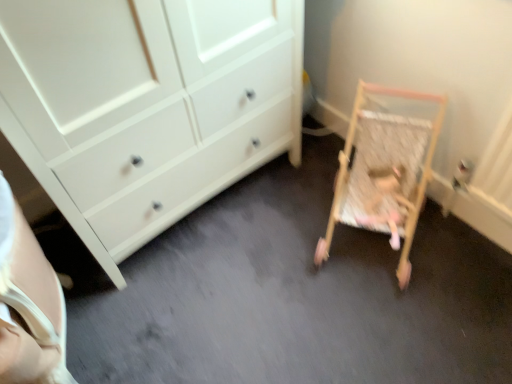
Question: Is wooden baby cot at lower right thinner than wooden rocking chair at right?

Choices:
 (A) no
 (B) yes

Answer: (A)

Question: Is wooden baby cot at lower right oriented away from wooden rocking chair at right?

Choices:
 (A) yes
 (B) no

Answer: (A)

Question: Would you say wooden baby cot at lower right is a long distance from wooden rocking chair at right?

Choices:
 (A) yes
 (B) no

Answer: (B)

Question: Does wooden baby cot at lower right appear on the right side of wooden rocking chair at right?

Choices:
 (A) yes
 (B) no

Answer: (B)

Question: Does wooden baby cot at lower right have a lesser height compared to wooden rocking chair at right?

Choices:
 (A) yes
 (B) no

Answer: (B)

Question: Is the depth of wooden baby cot at lower right greater than that of wooden rocking chair at right?

Choices:
 (A) no
 (B) yes

Answer: (A)

Question: Is wooden rocking chair at right shorter than wooden baby cot at lower right?

Choices:
 (A) yes
 (B) no

Answer: (A)

Question: Does wooden rocking chair at right lie in front of wooden baby cot at lower right?

Choices:
 (A) yes
 (B) no

Answer: (B)

Question: Is wooden rocking chair at right not within wooden baby cot at lower right?

Choices:
 (A) yes
 (B) no

Answer: (B)

Question: From the image's perspective, does wooden rocking chair at right appear higher than wooden baby cot at lower right?

Choices:
 (A) no
 (B) yes

Answer: (A)

Question: Can you confirm if wooden rocking chair at right is taller than wooden baby cot at lower right?

Choices:
 (A) yes
 (B) no

Answer: (B)

Question: Is wooden rocking chair at right far away from wooden baby cot at lower right?

Choices:
 (A) yes
 (B) no

Answer: (B)

Question: Relative to wooden baby cot at lower right, is wooden rocking chair at right in front or behind?

Choices:
 (A) behind
 (B) front

Answer: (A)